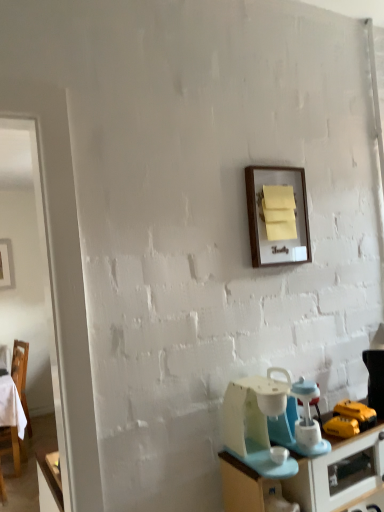
Question: Could you tell me if matte blue desk at lower right is facing wooden chair at left?

Choices:
 (A) yes
 (B) no

Answer: (B)

Question: Does matte blue desk at lower right have a larger size compared to wooden chair at left?

Choices:
 (A) no
 (B) yes

Answer: (B)

Question: From a real-world perspective, is matte blue desk at lower right positioned over wooden chair at left based on gravity?

Choices:
 (A) yes
 (B) no

Answer: (A)

Question: Considering the relative positions of matte blue desk at lower right and wooden chair at left in the image provided, is matte blue desk at lower right to the right of wooden chair at left from the viewer's perspective?

Choices:
 (A) no
 (B) yes

Answer: (B)

Question: Is the position of matte blue desk at lower right less distant than that of wooden chair at left?

Choices:
 (A) no
 (B) yes

Answer: (B)

Question: Is matte blue desk at lower right next to wooden chair at left?

Choices:
 (A) yes
 (B) no

Answer: (B)

Question: Can you confirm if wooden frame at upper center is taller than matte blue desk at lower right?

Choices:
 (A) no
 (B) yes

Answer: (A)

Question: Are wooden frame at upper center and matte blue desk at lower right making contact?

Choices:
 (A) yes
 (B) no

Answer: (B)

Question: Does wooden frame at upper center have a smaller size compared to matte blue desk at lower right?

Choices:
 (A) no
 (B) yes

Answer: (B)

Question: Does wooden frame at upper center have a lesser width compared to matte blue desk at lower right?

Choices:
 (A) no
 (B) yes

Answer: (B)

Question: Does wooden frame at upper center appear on the left side of matte blue desk at lower right?

Choices:
 (A) no
 (B) yes

Answer: (B)

Question: Considering the relative positions of wooden frame at upper center and matte blue desk at lower right in the image provided, is wooden frame at upper center in front of matte blue desk at lower right?

Choices:
 (A) no
 (B) yes

Answer: (A)

Question: From the image's perspective, is light blue plastic blender at lower right located beneath matte blue desk at lower right?

Choices:
 (A) yes
 (B) no

Answer: (B)